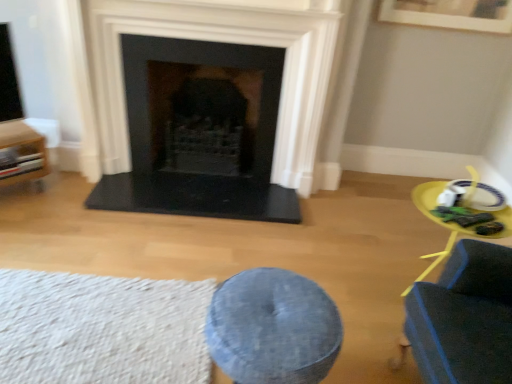
The height and width of the screenshot is (384, 512). I want to click on vacant space behind yellow plastic table at right, so click(395, 238).